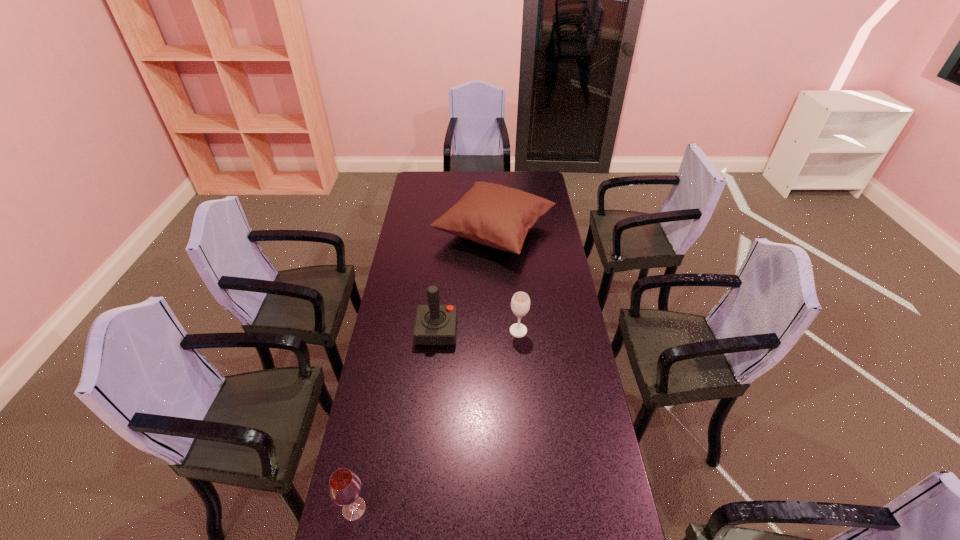
This screenshot has height=540, width=960. What are the coordinates of `cushion at the left edge` in the screenshot? It's located at (493, 215).

Where is `wineglass situated at the left edge`? wineglass situated at the left edge is located at coordinates [x=345, y=486].

You are a GUI agent. You are given a task and a screenshot of the screen. Output one action in this format:
    pyautogui.click(x=<x>, y=<y>)
    Task: Click on the object present at the right edge
    Image resolution: width=960 pixels, height=540 pixels.
    Given the screenshot: What is the action you would take?
    pyautogui.click(x=493, y=215)

This screenshot has width=960, height=540. In the image, there is a desktop. Find the location of `free space at the far edge`. free space at the far edge is located at coordinates (461, 191).

In the image, there is a desktop. Where is `vacant space at the left edge`? vacant space at the left edge is located at coordinates (396, 447).

Find the location of a particular element. This screenshot has height=540, width=960. vacant space at the right edge is located at coordinates (563, 401).

Identify the location of free space at the far left corner of the desktop. This screenshot has width=960, height=540. (427, 185).

I want to click on vacant area between the farthest object and the right wineglass, so click(x=506, y=281).

Identify the location of empty space that is in between the nearer wineglass and the cushion. (424, 369).

Find the location of a particular element. This screenshot has height=540, width=960. empty location between the cushion and the left wineglass is located at coordinates (424, 369).